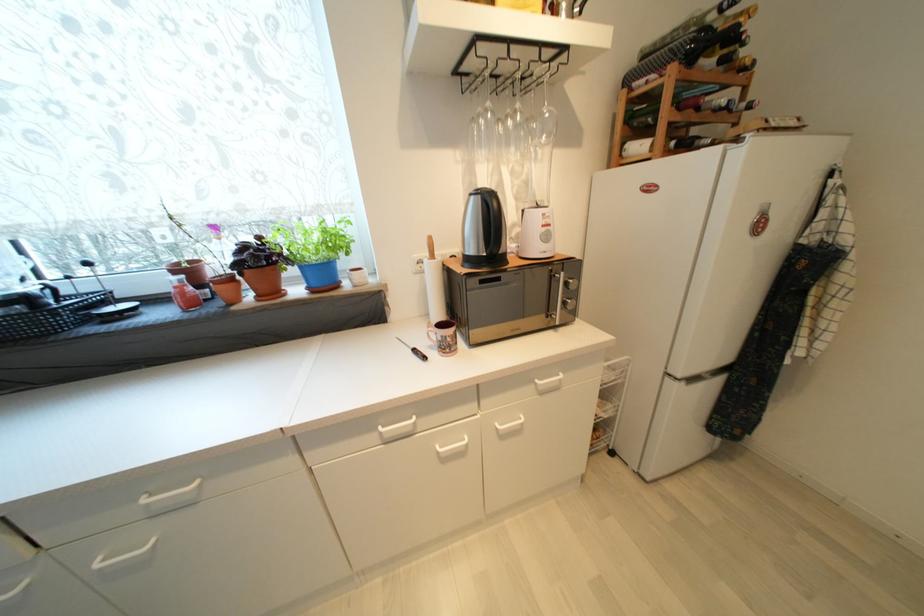
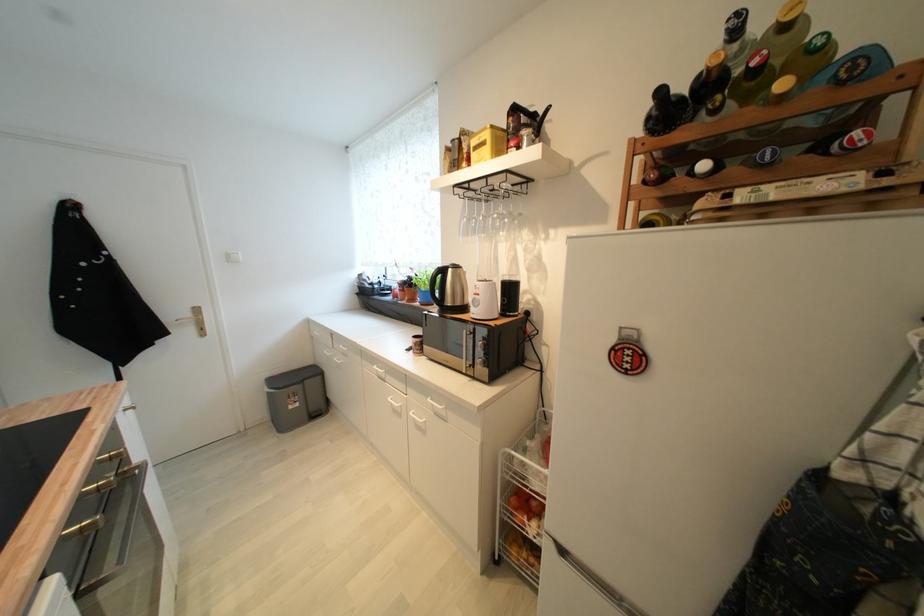
In the second image, find the point that corresponds to point 554,227 in the first image.

(483, 296)